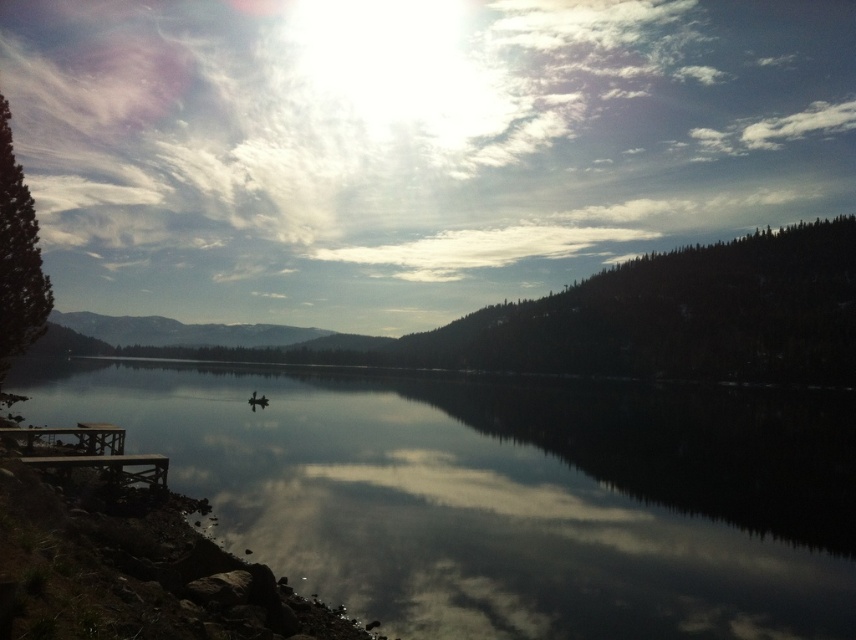
Question: From the image, what is the correct spatial relationship of smooth dark water at center in relation to wooden picnic table at lower left?

Choices:
 (A) left
 (B) right

Answer: (B)

Question: Among these objects, which one is farthest from the camera?

Choices:
 (A) wooden picnic table at lower left
 (B) smooth dark water at center

Answer: (A)

Question: Is smooth dark water at center to the right of wooden picnic table at lower left from the viewer's perspective?

Choices:
 (A) no
 (B) yes

Answer: (B)

Question: Which of the following is the farthest from the observer?

Choices:
 (A) (144, 472)
 (B) (833, 486)

Answer: (B)

Question: Which point is closer to the camera?

Choices:
 (A) (583, 545)
 (B) (21, 445)

Answer: (B)

Question: Is smooth dark water at center below wooden picnic table at lower left?

Choices:
 (A) yes
 (B) no

Answer: (A)